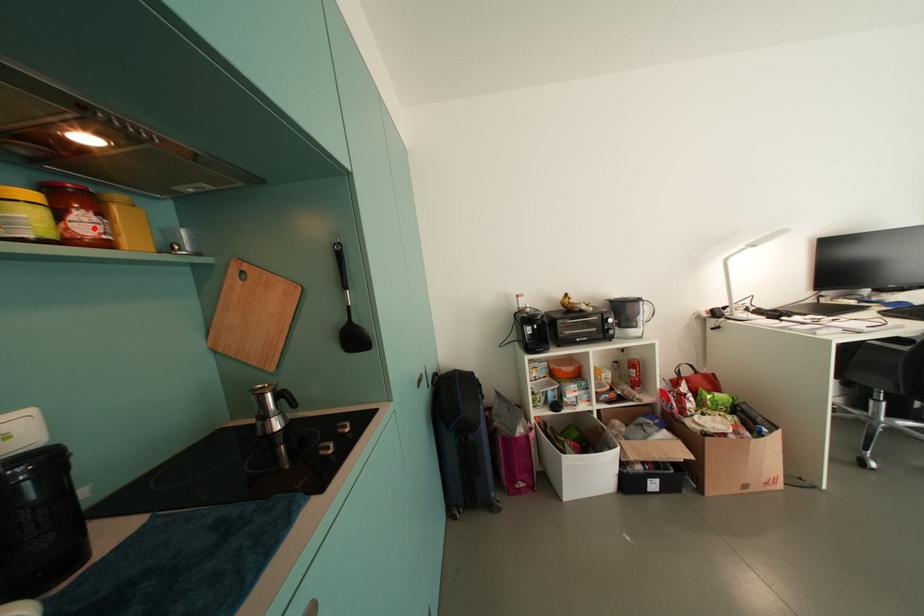
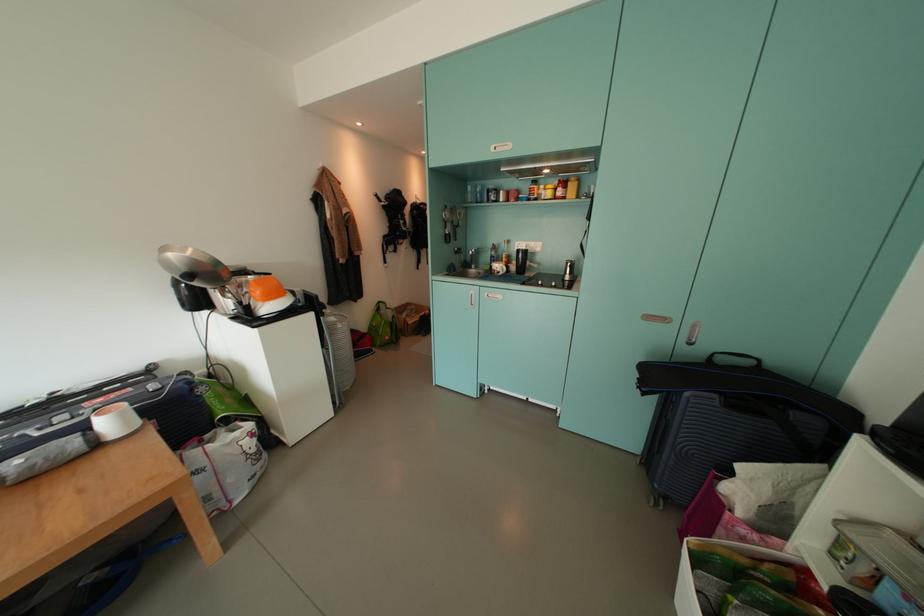
In the second image, find the point that corresponds to the highlighted location in the first image.

(566, 195)